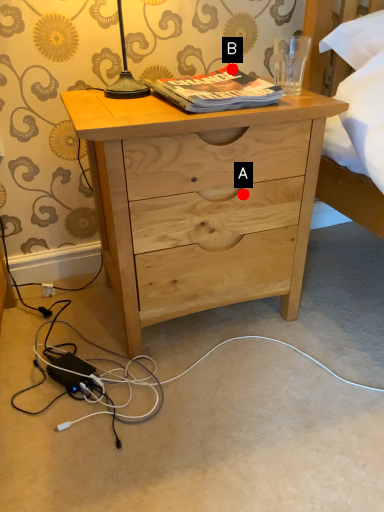
Question: Two points are circled on the image, labeled by A and B beside each circle. Which point appears closest to the camera in this image?

Choices:
 (A) A is closer
 (B) B is closer

Answer: (A)